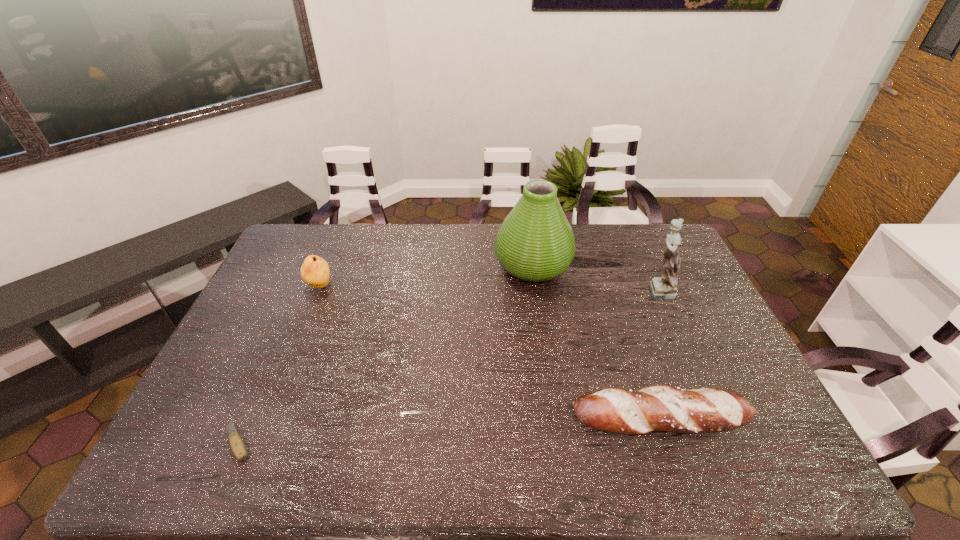
The height and width of the screenshot is (540, 960). I want to click on object located in the near right corner section of the desktop, so click(x=665, y=408).

I want to click on vacant area at the far edge of the desktop, so click(x=460, y=232).

This screenshot has height=540, width=960. I want to click on vacant space at the left edge of the desktop, so click(217, 366).

Locate an element on the screen. The height and width of the screenshot is (540, 960). free point at the right edge is located at coordinates pos(722,374).

In the image, there is a desktop. Where is `free region at the far left corner`? The image size is (960, 540). free region at the far left corner is located at coordinates (295, 231).

You are a GUI agent. You are given a task and a screenshot of the screen. Output one action in this format:
    pyautogui.click(x=<x>, y=<y>)
    Task: Click on the vacant area between the figurine and the third shortest object
    This screenshot has width=960, height=540.
    Given the screenshot: What is the action you would take?
    point(489,288)

Find the location of a particular element. Image resolution: width=960 pixels, height=540 pixels. unoccupied area between the baguet and the vase is located at coordinates (597, 342).

Locate an element on the screen. empty space between the second shortest object and the pear is located at coordinates (491, 353).

I want to click on free space that is in between the pear and the vase, so click(426, 275).

At what (x,y) coordinates should I click in order to perform the action: click on vacant space in between the figurine and the vase. Please return your answer as a coordinate pair (x, y). This screenshot has height=540, width=960. Looking at the image, I should click on [x=595, y=277].